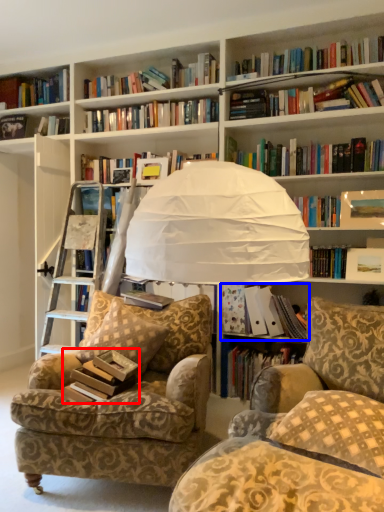
Question: Which object appears farthest to the camera in this image, paperback book (highlighted by a red box) or book (highlighted by a blue box)?

Choices:
 (A) paperback book
 (B) book

Answer: (B)